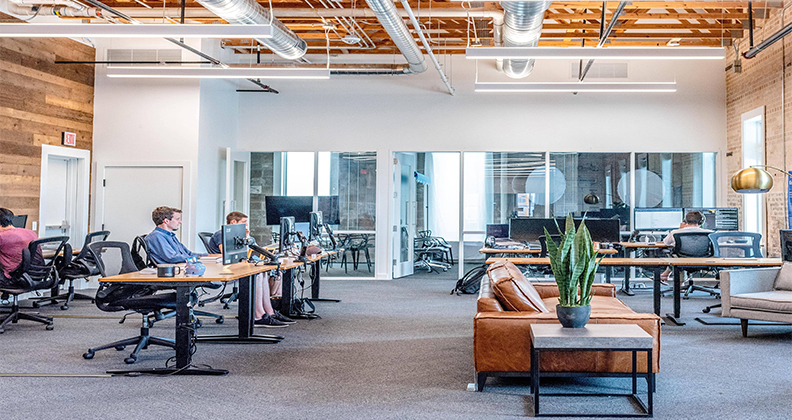
Where is `ceiling light`? ceiling light is located at coordinates (489, 51), (241, 33), (276, 72), (523, 86).